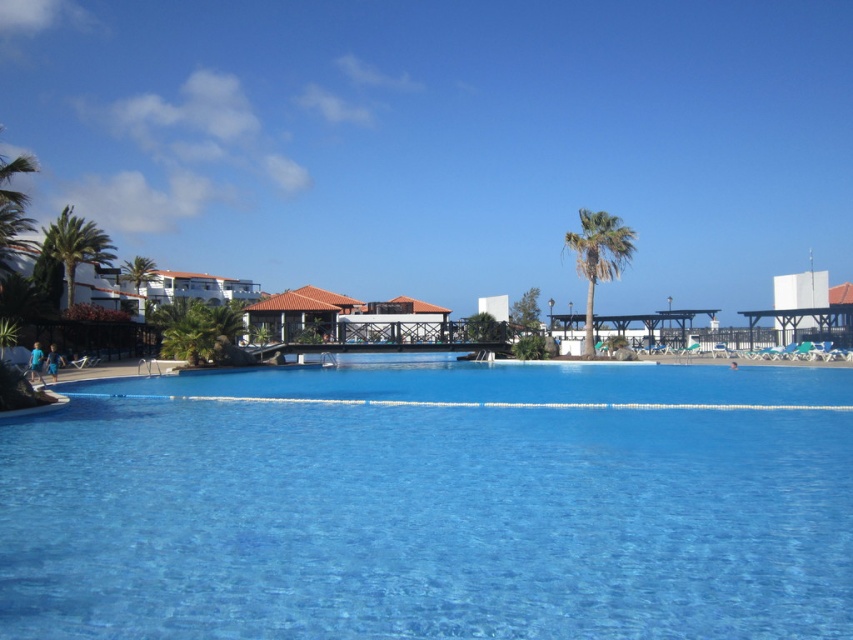
Question: Is green leafy palm tree at center wider than green leafy palm tree at left?

Choices:
 (A) yes
 (B) no

Answer: (B)

Question: From the image, what is the correct spatial relationship of transparent glass pool at center in relation to green leafy palm tree at left?

Choices:
 (A) right
 (B) left

Answer: (A)

Question: Among these points, which one is nearest to the camera?

Choices:
 (A) (602, 500)
 (B) (592, 337)

Answer: (A)

Question: Which of the following is the farthest from the observer?

Choices:
 (A) coord(62,225)
 (B) coord(589,413)
 (C) coord(619,230)

Answer: (A)

Question: Which of these objects is positioned closest to the transparent glass pool at center?

Choices:
 (A) green leafy palm tree at left
 (B) green leafy palm tree at center

Answer: (B)

Question: Does transparent glass pool at center appear over green leafy palm tree at center?

Choices:
 (A) no
 (B) yes

Answer: (A)